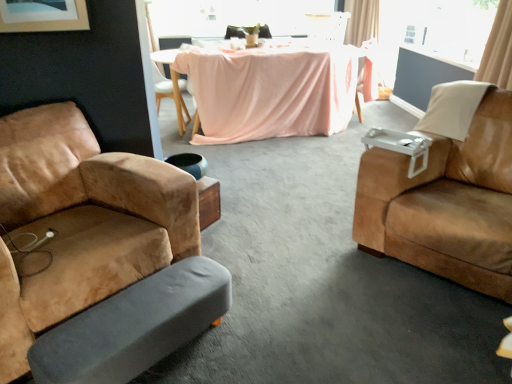
At what (x,y) coordinates should I click in order to perform the action: click on blank space to the left of suede brown couch at right, placed as the third chair when sorted from back to front. Please return your answer as a coordinate pair (x, y). The image size is (512, 384). Looking at the image, I should click on tap(317, 264).